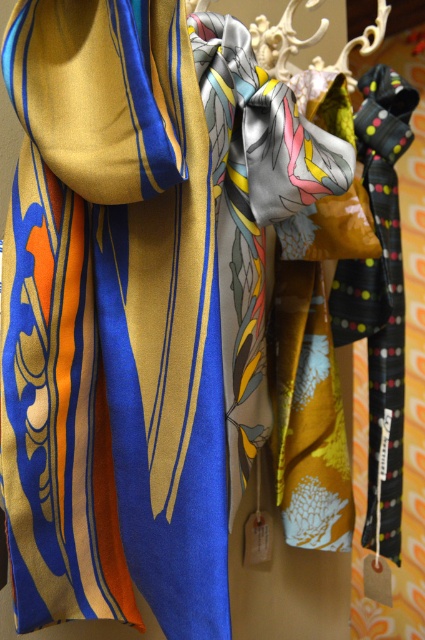
Question: Which point is farther to the camera?

Choices:
 (A) silky striped scarf at left
 (B) silky floral tie at center

Answer: (B)

Question: Which of the following is the closest to the observer?

Choices:
 (A) (197, 380)
 (B) (229, 412)

Answer: (A)

Question: In this image, where is silky striped scarf at left located relative to silky floral tie at center?

Choices:
 (A) below
 (B) above

Answer: (A)

Question: Can you confirm if silky striped scarf at left is thinner than silky floral tie at center?

Choices:
 (A) no
 (B) yes

Answer: (A)

Question: Is silky striped scarf at left smaller than silky floral tie at center?

Choices:
 (A) no
 (B) yes

Answer: (A)